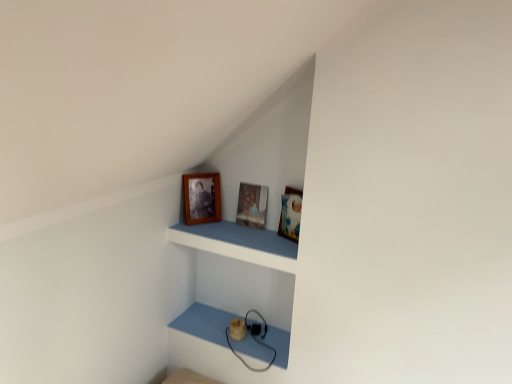
Question: Can you confirm if wooden frame at upper center is taller than wooden photo frame at upper center, placed as the 1th picture frame when sorted from left to right?

Choices:
 (A) no
 (B) yes

Answer: (A)

Question: Is there a large distance between wooden frame at upper center and wooden photo frame at upper center, which is counted as the second picture frame, starting from the right?

Choices:
 (A) yes
 (B) no

Answer: (B)

Question: Does wooden frame at upper center lie behind wooden photo frame at upper center, placed as the 1th picture frame when sorted from left to right?

Choices:
 (A) yes
 (B) no

Answer: (B)

Question: Is wooden frame at upper center beside wooden photo frame at upper center, placed as the 1th picture frame when sorted from left to right?

Choices:
 (A) yes
 (B) no

Answer: (B)

Question: From a real-world perspective, is wooden frame at upper center over wooden photo frame at upper center, which is counted as the second picture frame, starting from the right?

Choices:
 (A) no
 (B) yes

Answer: (A)

Question: Considering the relative sizes of wooden frame at upper center and wooden photo frame at upper center, which is counted as the second picture frame, starting from the right, in the image provided, is wooden frame at upper center wider than wooden photo frame at upper center, which is counted as the second picture frame, starting from the right,?

Choices:
 (A) yes
 (B) no

Answer: (A)

Question: Is wooden frame at upper center far away from wooden picture frame at center, positioned as the 2th picture frame in left-to-right order?

Choices:
 (A) yes
 (B) no

Answer: (B)

Question: Would you say wooden picture frame at center, positioned as the 2th picture frame in left-to-right order, is part of wooden frame at upper center's contents?

Choices:
 (A) no
 (B) yes

Answer: (A)

Question: Does wooden frame at upper center have a lesser width compared to wooden picture frame at center, which is the first picture frame in right-to-left order?

Choices:
 (A) no
 (B) yes

Answer: (A)

Question: Are wooden frame at upper center and wooden picture frame at center, which is the first picture frame in right-to-left order, making contact?

Choices:
 (A) no
 (B) yes

Answer: (A)

Question: Is wooden frame at upper center taller than wooden picture frame at center, which is the first picture frame in right-to-left order?

Choices:
 (A) no
 (B) yes

Answer: (A)

Question: From the image's perspective, is wooden frame at upper center on wooden picture frame at center, which is the first picture frame in right-to-left order?

Choices:
 (A) yes
 (B) no

Answer: (B)

Question: Is wooden picture frame at center, which is the first picture frame in right-to-left order, far from wooden photo frame at upper center, which is counted as the second picture frame, starting from the right?

Choices:
 (A) no
 (B) yes

Answer: (A)